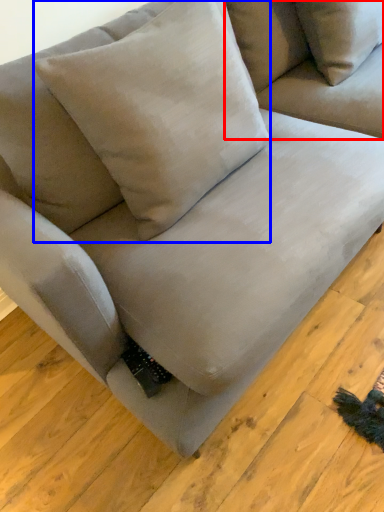
Question: Which object appears farthest to the camera in this image, couch (highlighted by a red box) or pillow (highlighted by a blue box)?

Choices:
 (A) couch
 (B) pillow

Answer: (A)